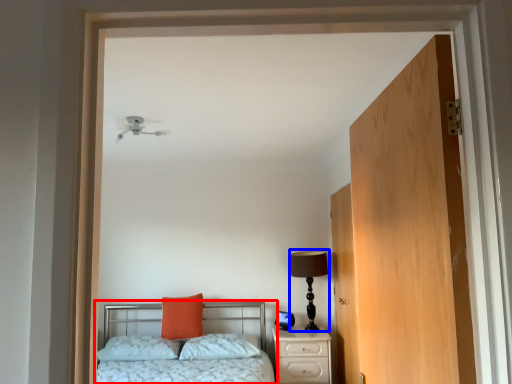
Question: Which object appears farthest to the camera in this image, bed (highlighted by a red box) or table lamp (highlighted by a blue box)?

Choices:
 (A) bed
 (B) table lamp

Answer: (B)